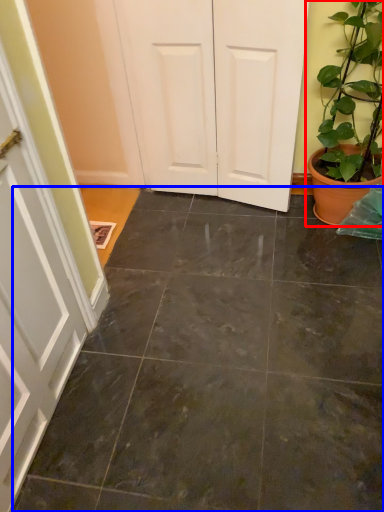
Question: Which object appears closest to the camera in this image, houseplant (highlighted by a red box) or concrete (highlighted by a blue box)?

Choices:
 (A) houseplant
 (B) concrete

Answer: (B)